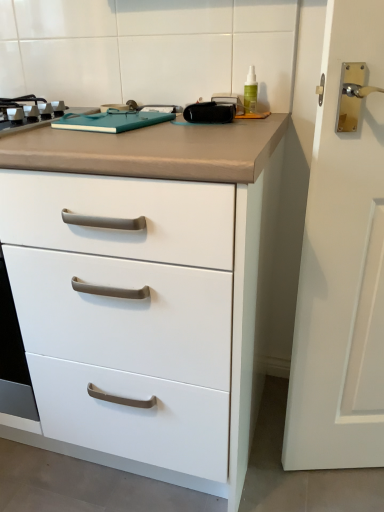
Identify the location of vacant area that is in front of green translucent bottle at upper right. The height and width of the screenshot is (512, 384). (254, 124).